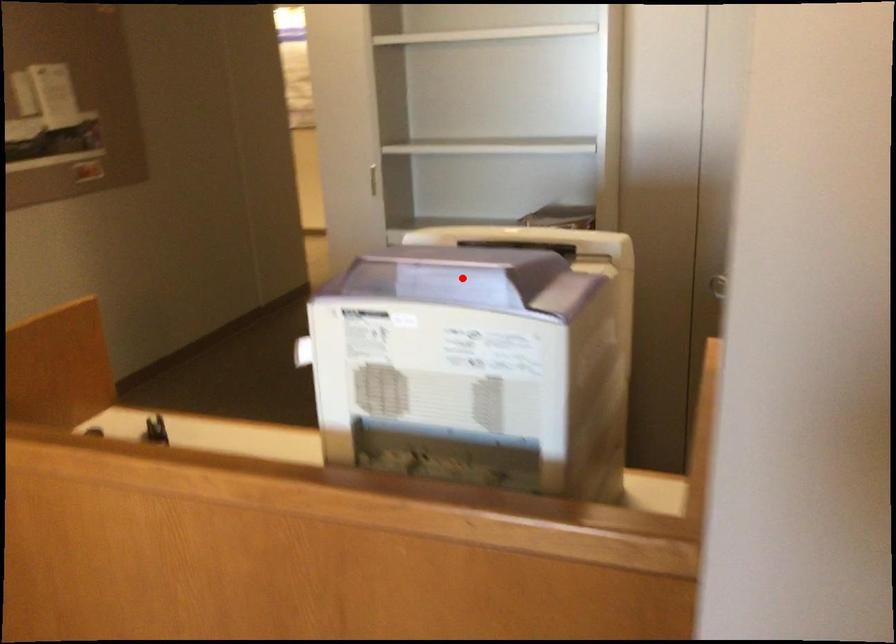
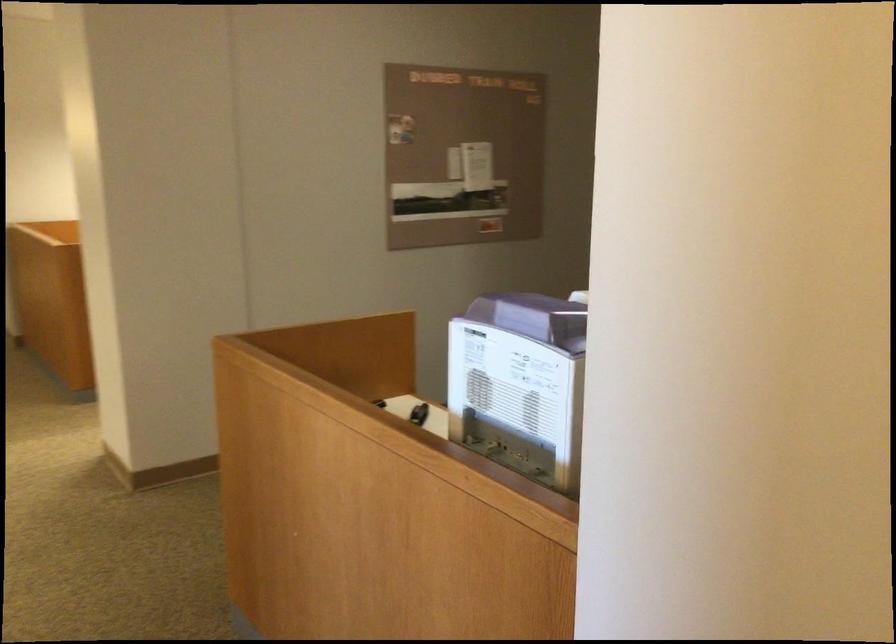
In the second image, find the point that corresponds to the highlighted location in the first image.

(540, 316)